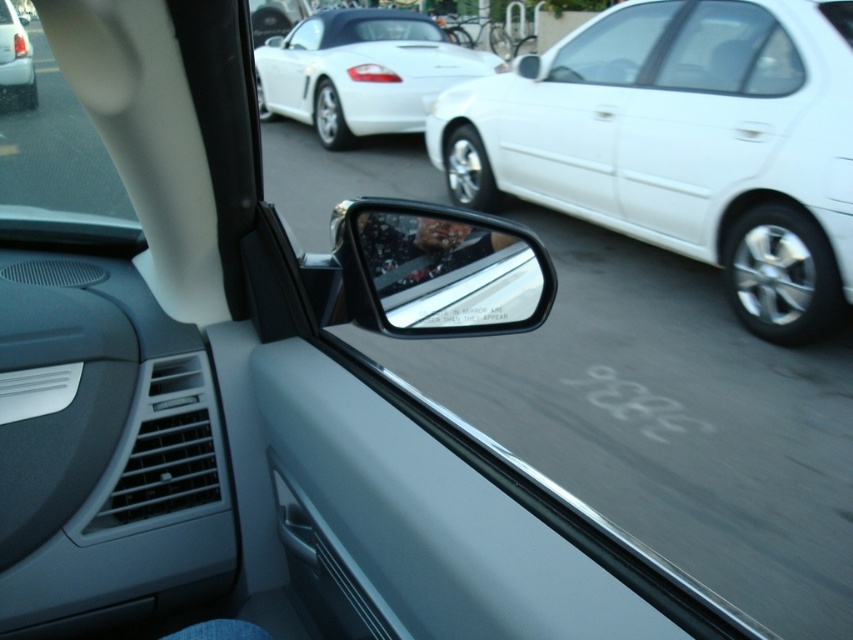
You are sitting in the driver seat of the car and want to check both the clear glass mirror at center and the white glossy convertible at upper center. Which object is closer to you?

The clear glass mirror at center is closer to the viewer than the white glossy convertible at upper center, so the clear glass mirror at center is closer to you.

You are a passenger in the car and looking out the window. There is a point marked at coordinates (361, 72). What object does this point correspond to?

The point at coordinates (361, 72) corresponds to the white glossy convertible at upper center.